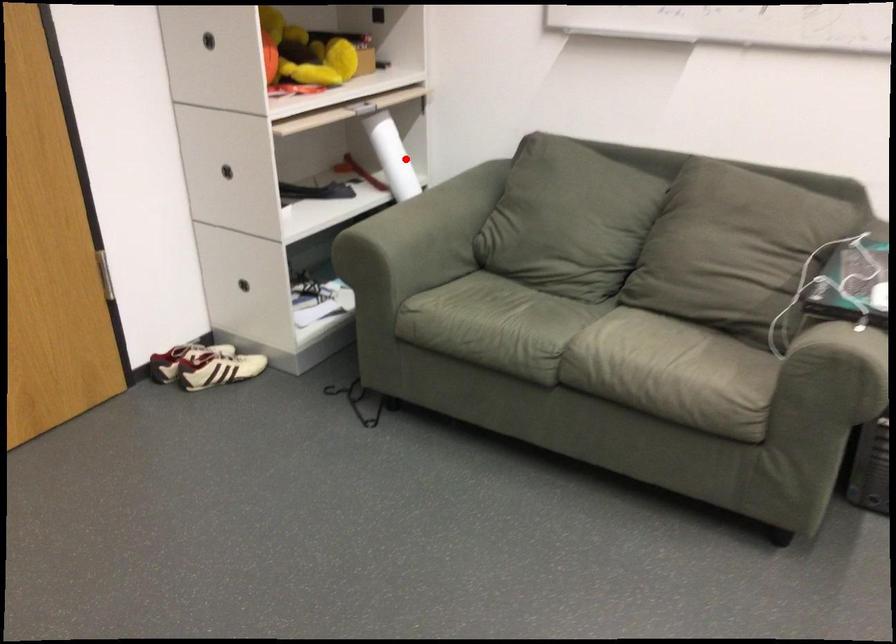
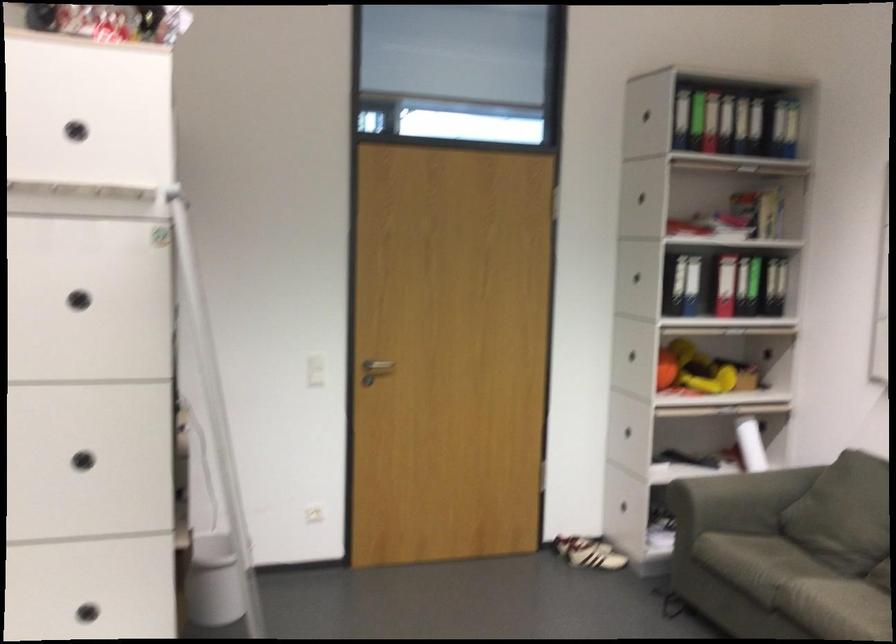
In the second image, find the point that corresponds to the highlighted location in the first image.

(750, 444)